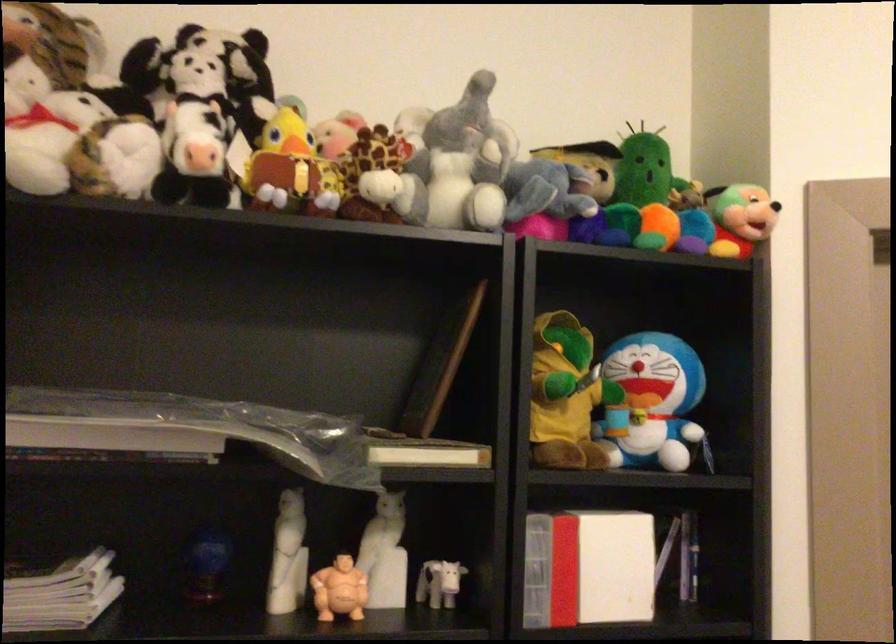
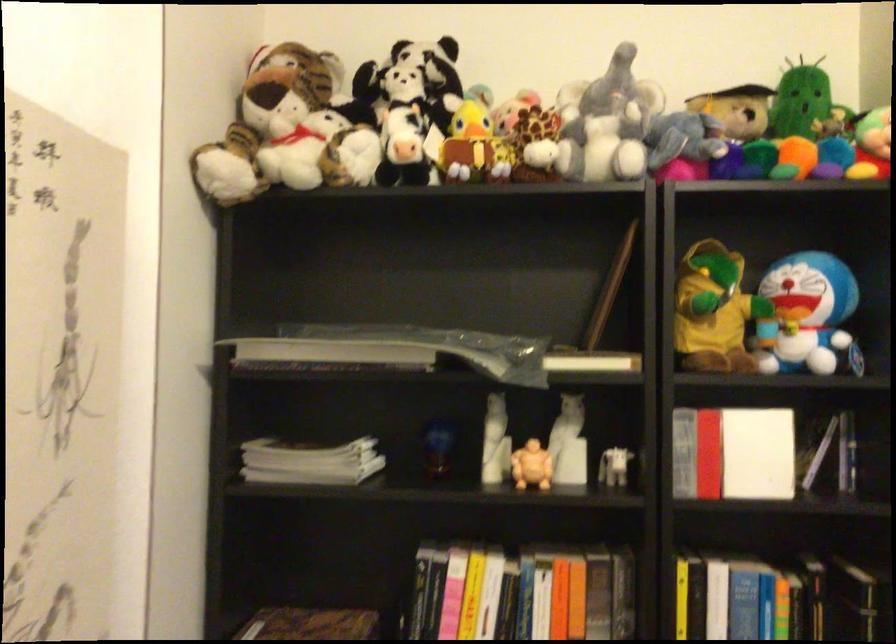
In the second image, find the point that corresponds to (295,169) in the first image.

(475, 146)